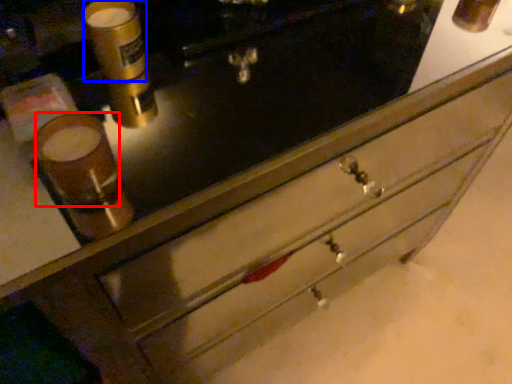
Question: Which of the following is the farthest to the observer, beverage (highlighted by a red box) or beverage (highlighted by a blue box)?

Choices:
 (A) beverage
 (B) beverage

Answer: (B)